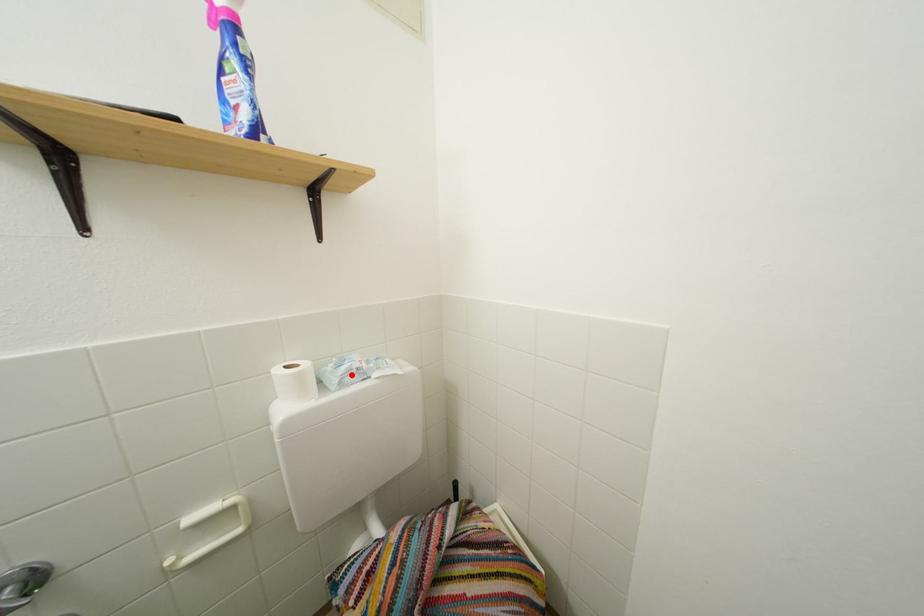
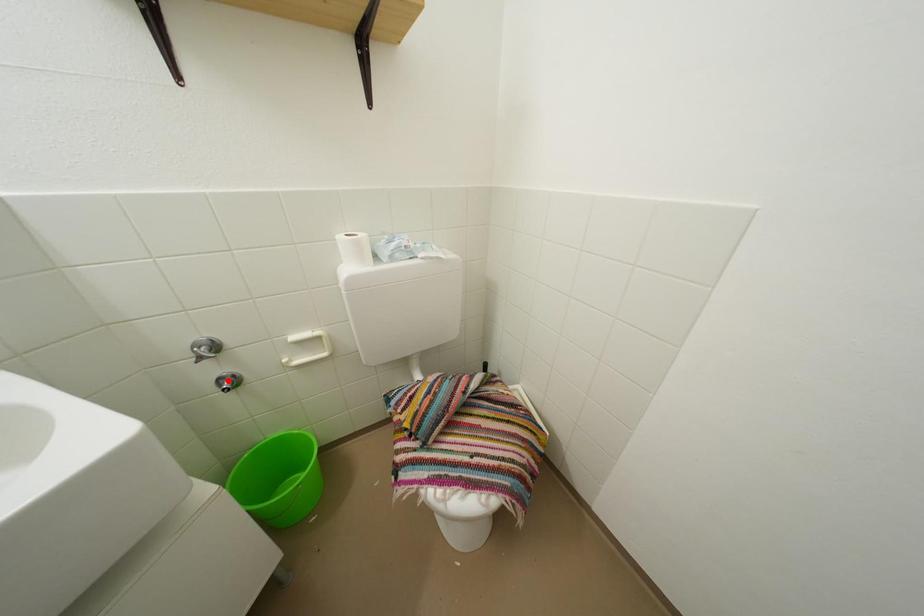
I am providing you with two images of the same scene from different viewpoints. A red point is marked on the first image and another point is marked on the second image. Do the highlighted points in image1 and image2 indicate the same real-world spot?

No